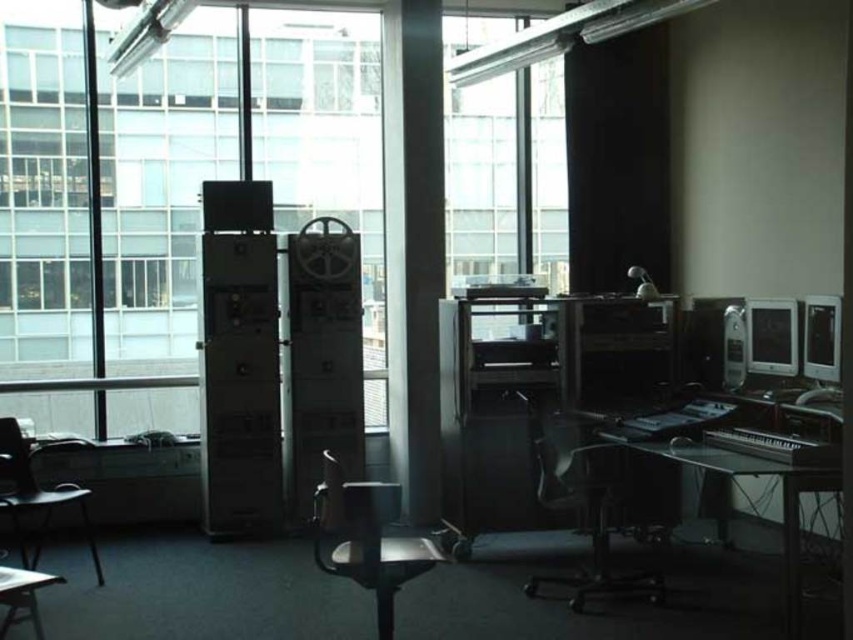
You are sitting in the transparent plastic swivel chair at center and want to look out the transparent glass window at center. Can you see the window without moving your head?

The transparent glass window at center is above the transparent plastic swivel chair at center, so you can see the window without moving your head as long as you look upward.

You are a person who is 1.7 meters tall. You are sitting on the transparent plastic swivel chair at center and want to reach the black glass table at lower right. Can you comfortably reach the table surface without standing up?

The transparent plastic swivel chair at center is taller than the black glass table at lower right, so when sitting on the chair, your arms would likely be able to comfortably reach the table surface without needing to stand up.